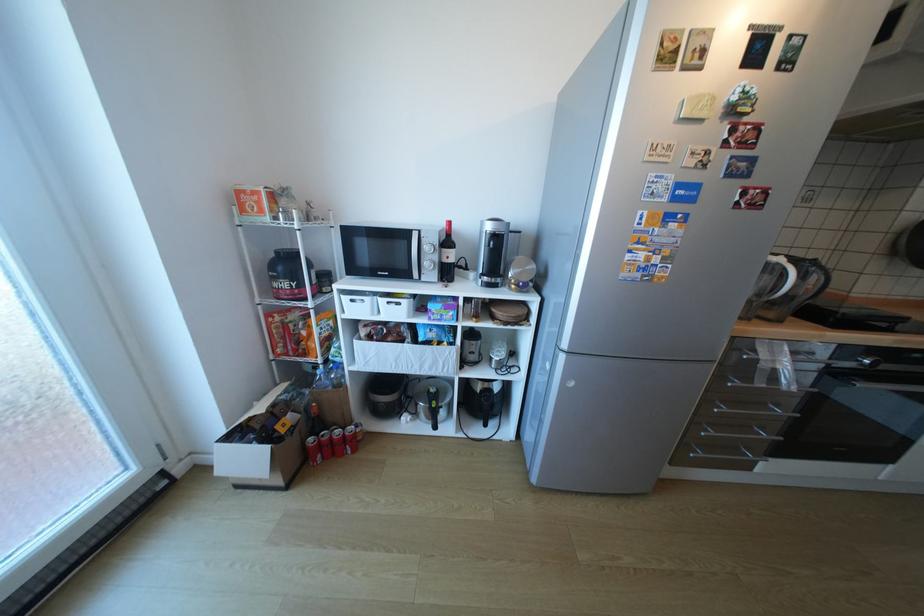
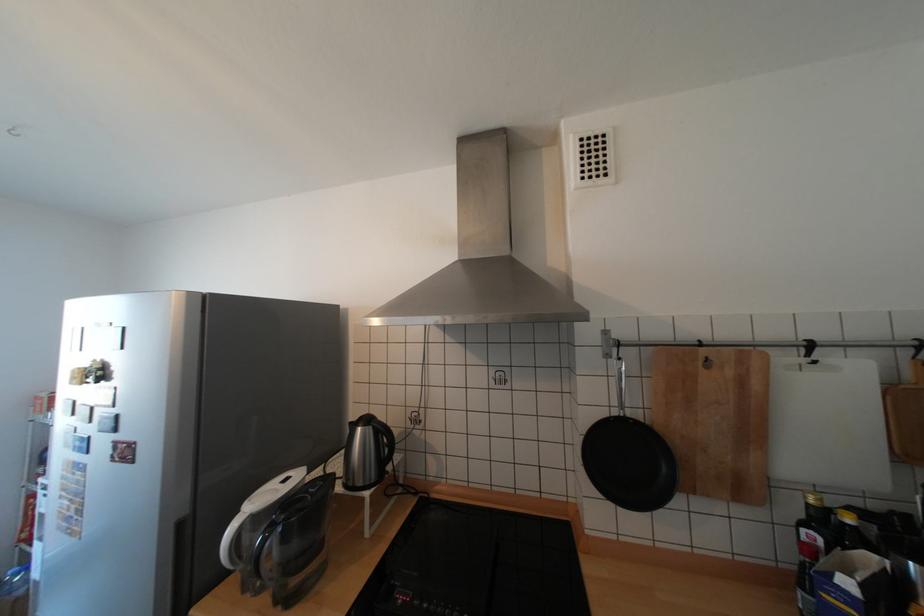
Question: In a continuous first-person perspective shot, in which direction is the camera moving?

Choices:
 (A) Left
 (B) Right
 (C) Forward
 (D) Backward

Answer: (B)